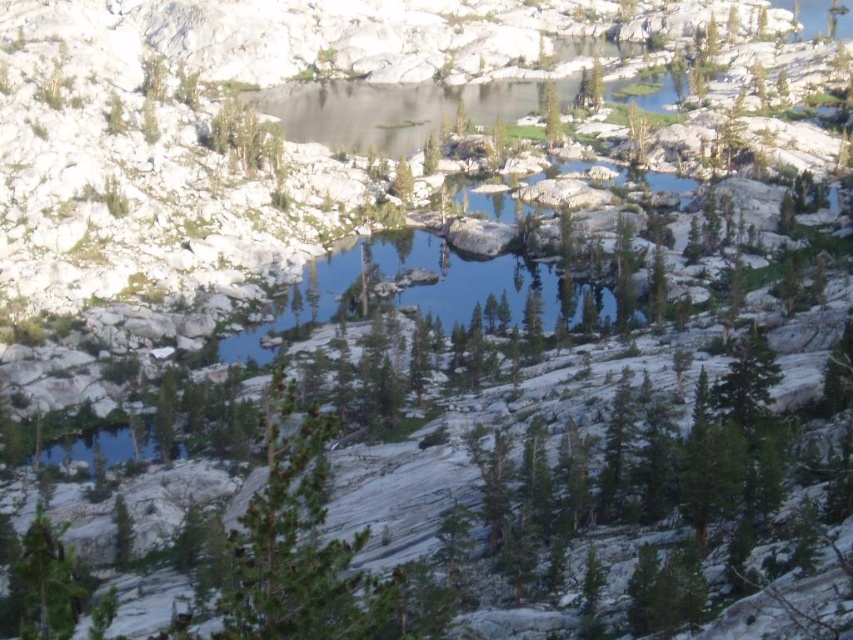
Who is more forward, (252,588) or (39,609)?

Point (39,609) is in front.

Does point (262, 588) lie in front of point (24, 572)?

No.

Locate an element on the screen. The width and height of the screenshot is (853, 640). green textured pine tree at center is located at coordinates (294, 545).